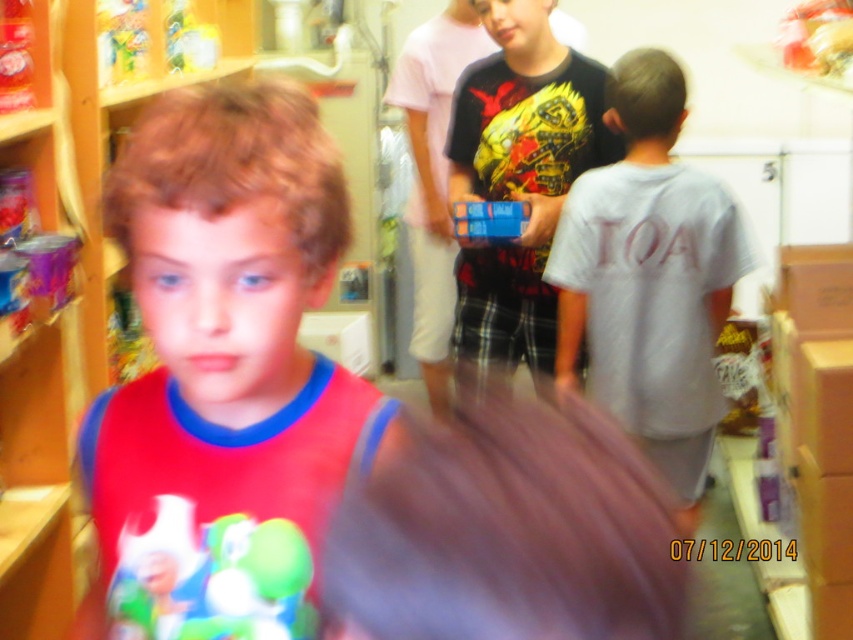
From the picture: Is brown hair at center closer to the viewer compared to matte plastic toy at center?

Yes.

Describe the element at coordinates (506, 532) in the screenshot. This screenshot has width=853, height=640. I see `brown hair at center` at that location.

Which is in front, point (640, 483) or point (263, 563)?

Point (640, 483)

Identify the location of brown hair at center. (506, 532).

Does brown hair at center have a larger size compared to blue plastic toy at center?

Yes, brown hair at center is bigger than blue plastic toy at center.

Is brown hair at center in front of blue plastic toy at center?

Yes, brown hair at center is in front of blue plastic toy at center.

Looking at this image, measure the distance between brown hair at center and camera.

They are 13.46 inches apart.

At what (x,y) coordinates should I click in order to perform the action: click on brown hair at center. Please return your answer as a coordinate pair (x, y). This screenshot has height=640, width=853. Looking at the image, I should click on [x=506, y=532].

Who is positioned more to the left, wooden bookshelf at left or matte plastic toy at center?

wooden bookshelf at left is more to the left.

Image resolution: width=853 pixels, height=640 pixels. Describe the element at coordinates (82, 234) in the screenshot. I see `wooden bookshelf at left` at that location.

I want to click on wooden bookshelf at left, so point(82,234).